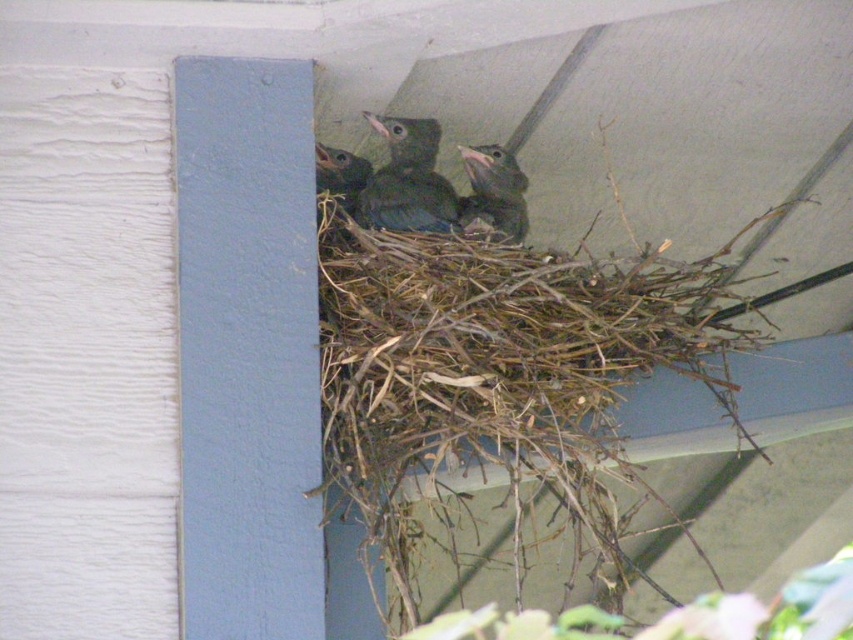
Which is above, green matte bird at center or green feathered bird at upper center?

Positioned higher is green matte bird at center.

Is green matte bird at center to the left of green feathered bird at upper center from the viewer's perspective?

Yes, green matte bird at center is to the left of green feathered bird at upper center.

Is point (412, 196) less distant than point (486, 160)?

Yes, point (412, 196) is closer to viewer.

You are a GUI agent. You are given a task and a screenshot of the screen. Output one action in this format:
    pyautogui.click(x=<x>, y=<y>)
    Task: Click on the green matte bird at center
    
    Given the screenshot: What is the action you would take?
    pyautogui.click(x=407, y=180)

Does green feathered bird at upper center have a larger size compared to dark green feathers at upper center?

Yes, green feathered bird at upper center is bigger than dark green feathers at upper center.

Consider the image. Who is taller, green feathered bird at upper center or dark green feathers at upper center?

green feathered bird at upper center

Does point (521, 227) lie behind point (345, 202)?

Yes, it is behind point (345, 202).

Identify the location of green feathered bird at upper center. This screenshot has width=853, height=640. (494, 193).

Looking at this image, between green matte bird at center and dark green feathers at upper center, which one appears on the left side from the viewer's perspective?

dark green feathers at upper center is more to the left.

Between green matte bird at center and dark green feathers at upper center, which one has more height?

green matte bird at center is taller.

What do you see at coordinates (407, 180) in the screenshot? The width and height of the screenshot is (853, 640). I see `green matte bird at center` at bounding box center [407, 180].

The image size is (853, 640). Find the location of `green matte bird at center`. green matte bird at center is located at coordinates (407, 180).